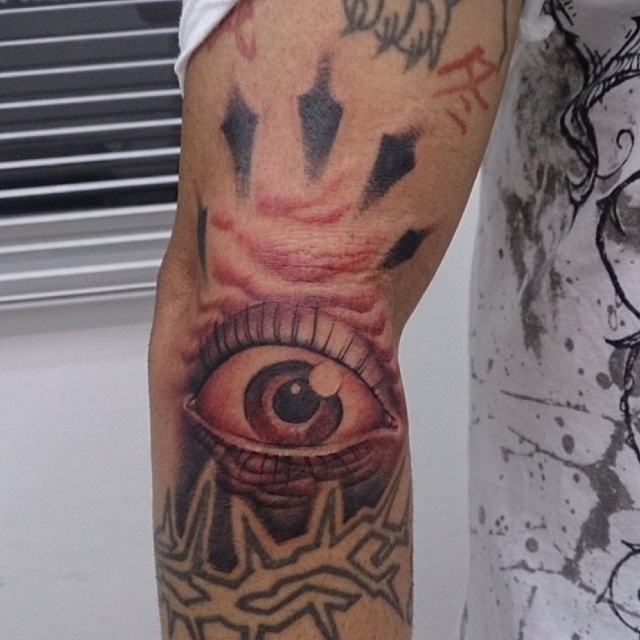
Question: Among these objects, which one is nearest to the camera?

Choices:
 (A) brown glossy eye at center
 (B) black tattooed eye at center

Answer: (B)

Question: Can you confirm if black tattooed eye at center is positioned to the right of brown glossy eye at center?

Choices:
 (A) yes
 (B) no

Answer: (B)

Question: Does black tattooed eye at center have a larger size compared to brown glossy eye at center?

Choices:
 (A) no
 (B) yes

Answer: (B)

Question: Which of the following is the farthest from the observer?

Choices:
 (A) black tattooed eye at center
 (B) brown glossy eye at center

Answer: (B)

Question: Can you confirm if black tattooed eye at center is positioned to the left of brown glossy eye at center?

Choices:
 (A) yes
 (B) no

Answer: (A)